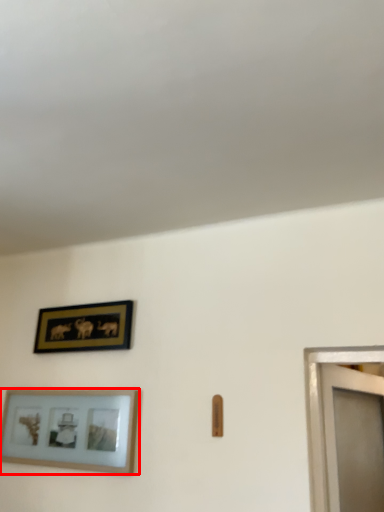
Question: From the image's perspective, what is the correct spatial relationship of picture frame (annotated by the red box) in relation to picture frame?

Choices:
 (A) below
 (B) above

Answer: (A)